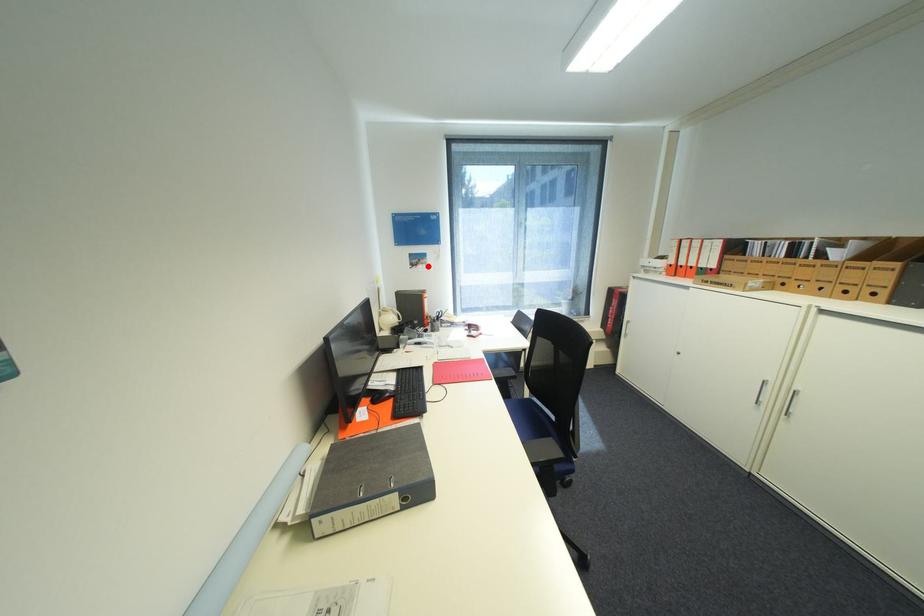
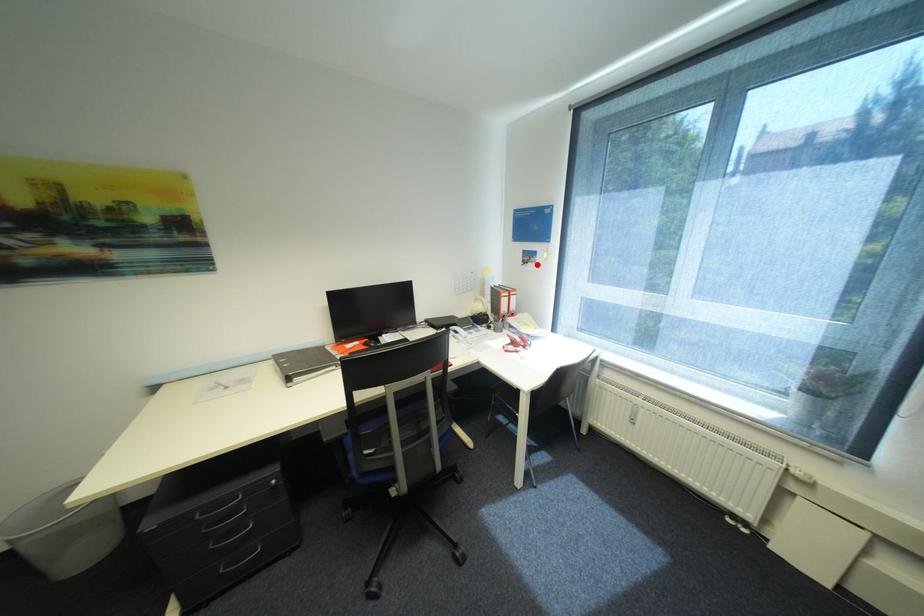
I am providing you with two images of the same scene from different viewpoints. A red point is marked on the first image and another point is marked on the second image. Are the points marked in image1 and image2 representing the same 3D position?

Yes